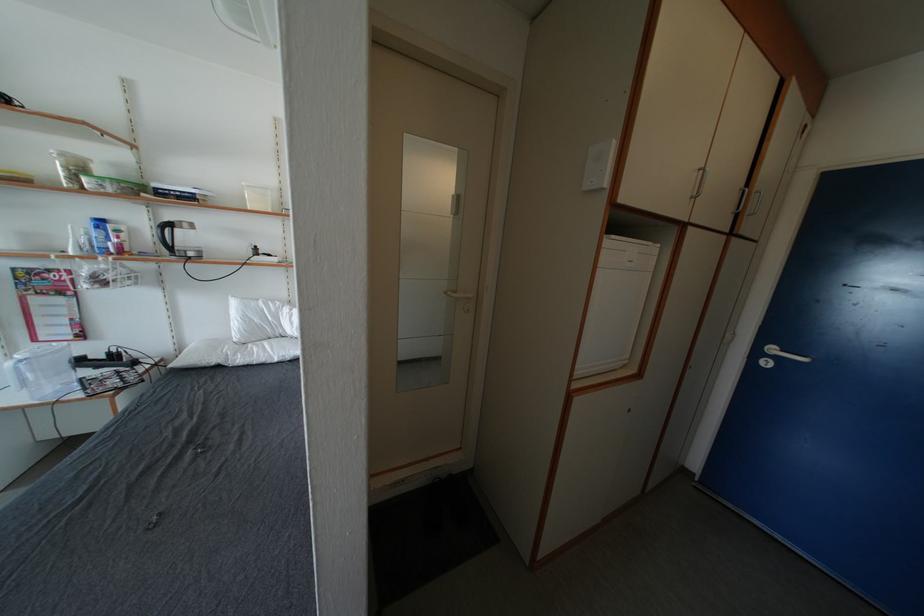
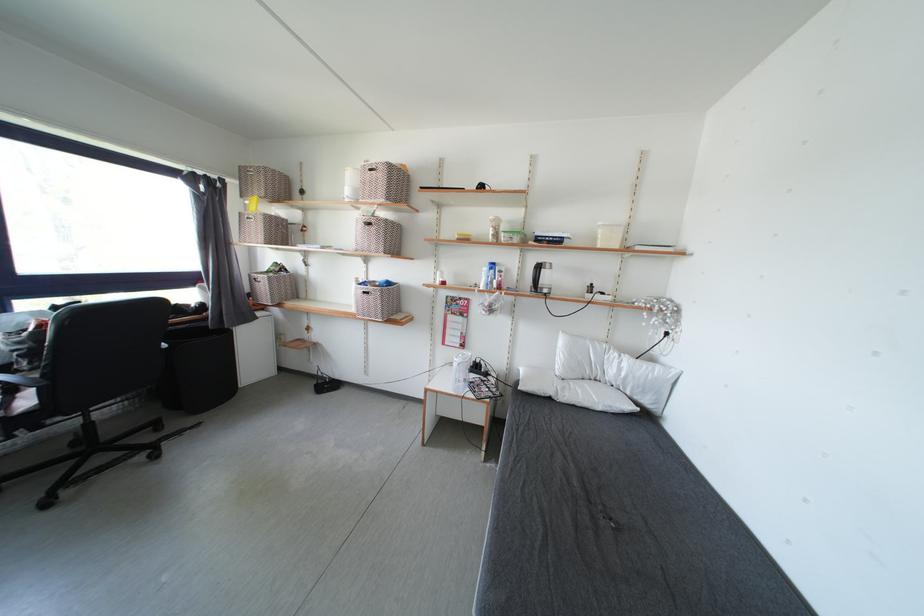
Find the pixel in the second image that matches (x=176, y=230) in the first image.

(545, 270)